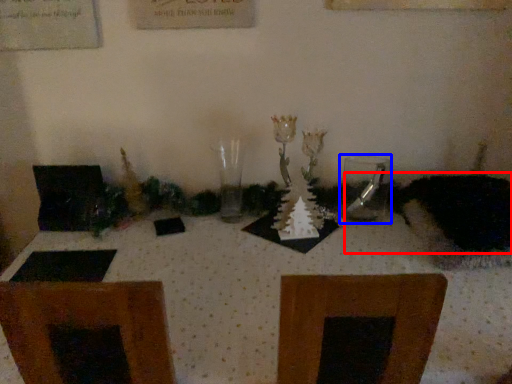
Question: Which of the following is the closest to the observer, animal (highlighted by a red box) or tableware (highlighted by a blue box)?

Choices:
 (A) animal
 (B) tableware

Answer: (A)